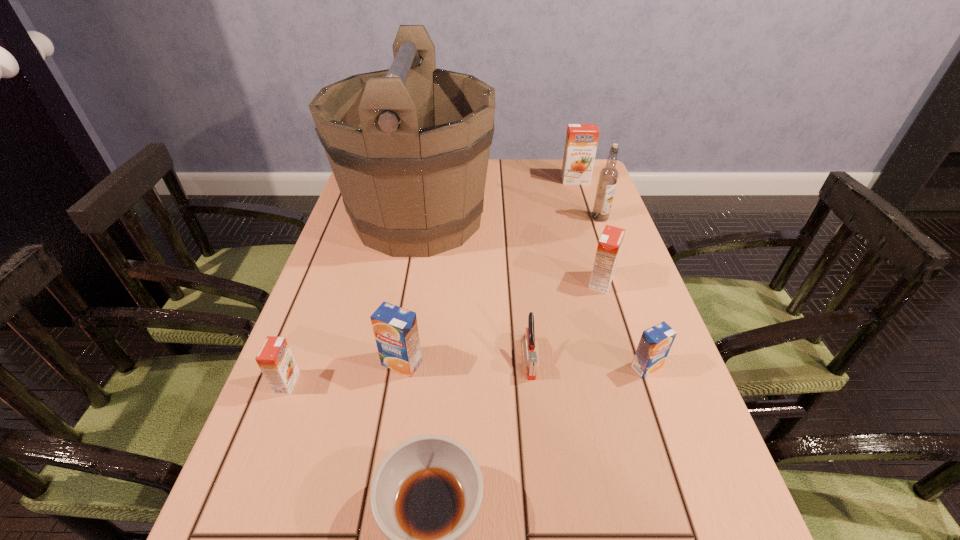
The image size is (960, 540). In order to click on orange juice that is the closest to the right blue orange_juice in this screenshot , I will do `click(609, 245)`.

Identify which orange juice is the second closest to the fourth nearest orange juice. Please provide its 2D coordinates. Your answer should be formatted as a tuple, i.e. [(x, y)], where the tuple contains the x and y coordinates of a point satisfying the conditions above.

[(395, 329)]

Where is `the third closest orange orange juice to the bucket`? This screenshot has height=540, width=960. the third closest orange orange juice to the bucket is located at coordinates (275, 359).

Where is `the closest orange orange juice to the nearest object`? the closest orange orange juice to the nearest object is located at coordinates (275, 359).

Identify the location of free location that satisfies the following two spatial constraints: 1. on the handle side of the right blue orange_juice; 2. on the left side of the gray stapler. The image size is (960, 540). (531, 367).

Identify the location of vacant region that satisfies the following two spatial constraints: 1. on the back side of the bucket; 2. on the right side of the nearest orange orange juice. (350, 218).

Where is `free space that satisfies the following two spatial constraints: 1. on the back side of the third tallest object; 2. on the right side of the smallest orange orange juice`? free space that satisfies the following two spatial constraints: 1. on the back side of the third tallest object; 2. on the right side of the smallest orange orange juice is located at coordinates (365, 180).

Locate an element on the screen. The height and width of the screenshot is (540, 960). blank space that satisfies the following two spatial constraints: 1. on the front side of the bigger blue orange_juice; 2. on the right side of the bucket is located at coordinates (392, 363).